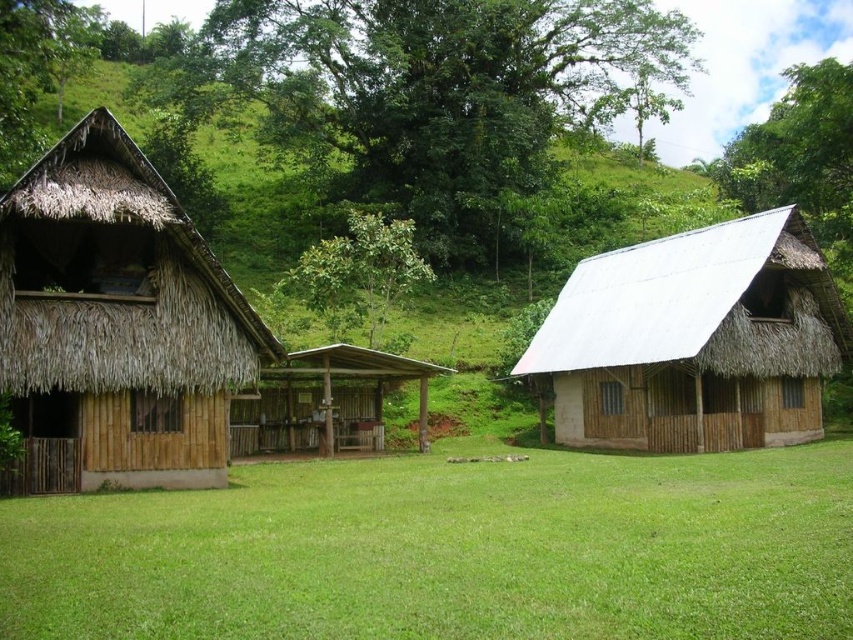
You are standing at the origin point of the image. Looking at the green leafy tree at upper center, can you tell me its coordinates? Please provide the coordinates in the format of a point like this example format of point notation.

The green leafy tree at upper center is located at point coordinates of (422,92).

You are a gardener planning to plant a new tree in this rural setting. Considering the thatched bamboo hut at left and the green leafy tree at center, which object should you avoid planting a large tree near to prevent potential damage from its roots?

You should avoid planting a large tree near the thatched bamboo hut at left because it is smaller than the green leafy tree at center, making it more vulnerable to root damage.

You are standing on the green lawn in front of the two houses. You notice two green leafy trees in the upper part of the image. Which tree, the green leafy tree at upper center or the green leafy tree at upper left, is closer to you?

The green leafy tree at upper center is closer to you because the green leafy tree at upper left is behind it.